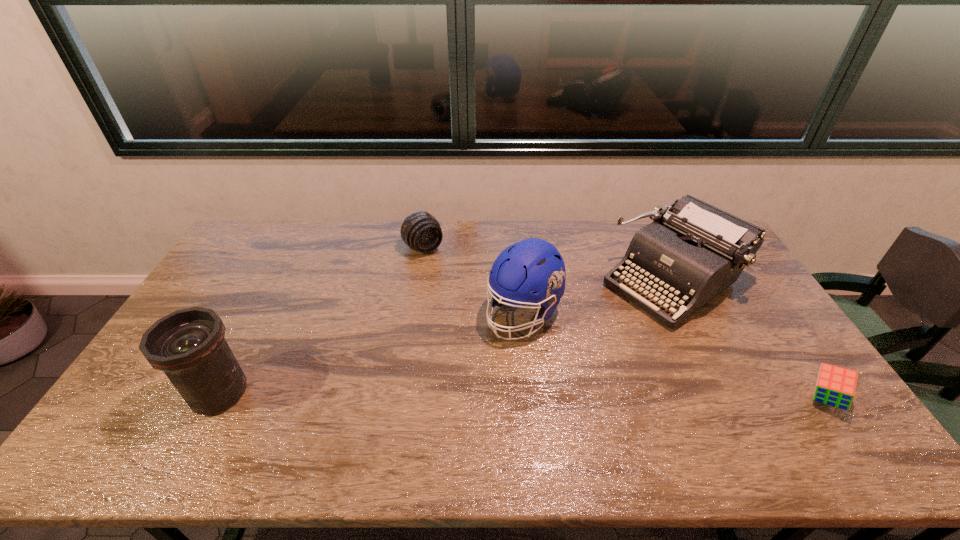
You are a GUI agent. You are given a task and a screenshot of the screen. Output one action in this format:
    pyautogui.click(x=<x>, y=<y>)
    Task: Click on the vacant point located 0.050m on the front-facing side of the third object from left to right
    
    Given the screenshot: What is the action you would take?
    492,350

The image size is (960, 540). What are the coordinates of `free space located 0.260m on the front-facing side of the third object from left to right` in the screenshot? It's located at (446, 401).

In order to click on vacant space located on the front-facing side of the typewriter in this screenshot , I will do `click(561, 354)`.

At what (x,y) coordinates should I click in order to perform the action: click on free location located 0.060m on the front-facing side of the typewriter. Please return your answer as a coordinate pair (x, y). The width and height of the screenshot is (960, 540). Looking at the image, I should click on (613, 318).

You are a GUI agent. You are given a task and a screenshot of the screen. Output one action in this format:
    pyautogui.click(x=<x>, y=<y>)
    Task: Click on the vacant space located 0.310m on the front-facing side of the typewriter
    This screenshot has height=540, width=960.
    Given the screenshot: What is the action you would take?
    pyautogui.click(x=556, y=357)

Where is `vacant space situated 0.380m at the front element of the shorter telephoto lens`? This screenshot has height=540, width=960. vacant space situated 0.380m at the front element of the shorter telephoto lens is located at coordinates (492, 325).

The height and width of the screenshot is (540, 960). Identify the location of vacant space located 0.130m at the front element of the shorter telephoto lens. (451, 279).

This screenshot has width=960, height=540. I want to click on vacant space located 0.280m at the front element of the shorter telephoto lens, so click(474, 305).

Locate an element on the screen. typewriter located in the far edge section of the desktop is located at coordinates click(x=692, y=251).

Locate an element on the screen. The width and height of the screenshot is (960, 540). telephoto lens at the far edge is located at coordinates (420, 230).